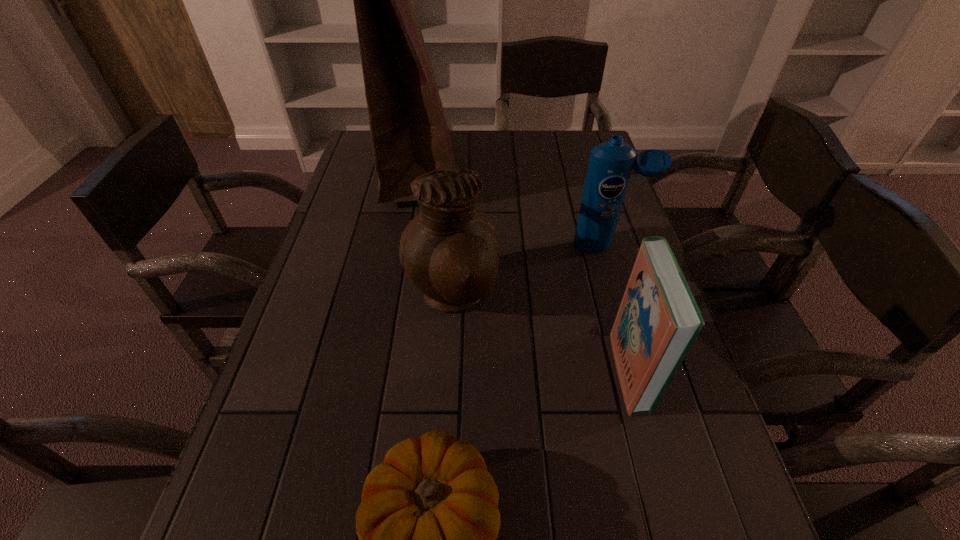
At what (x,y) coordinates should I click in order to perform the action: click on vacant space located 0.180m on the cover of the hardback book. Please return your answer as a coordinate pair (x, y). The width and height of the screenshot is (960, 540). Looking at the image, I should click on click(x=528, y=370).

Locate an element on the screen. This screenshot has width=960, height=540. object at the far edge is located at coordinates (409, 132).

This screenshot has height=540, width=960. In order to click on object that is at the left edge in this screenshot , I will do `click(409, 132)`.

The image size is (960, 540). I want to click on shampoo that is at the right edge, so click(x=611, y=163).

Identify the location of hardback book that is at the right edge. The height and width of the screenshot is (540, 960). (658, 320).

This screenshot has width=960, height=540. Find the location of `object located in the far left corner section of the desktop`. object located in the far left corner section of the desktop is located at coordinates (409, 132).

Locate an element on the screen. free space at the far edge of the desktop is located at coordinates (471, 149).

At what (x,y) coordinates should I click in order to perform the action: click on free space at the left edge of the desktop. Please return your answer as a coordinate pair (x, y). Looking at the image, I should click on click(272, 498).

In the image, there is a desktop. At what (x,y) coordinates should I click in order to perform the action: click on vacant space at the right edge. Please return your answer as a coordinate pair (x, y). The width and height of the screenshot is (960, 540). Looking at the image, I should click on (572, 197).

In the image, there is a desktop. Where is `vacant space at the far right corner`? This screenshot has width=960, height=540. vacant space at the far right corner is located at coordinates (559, 159).